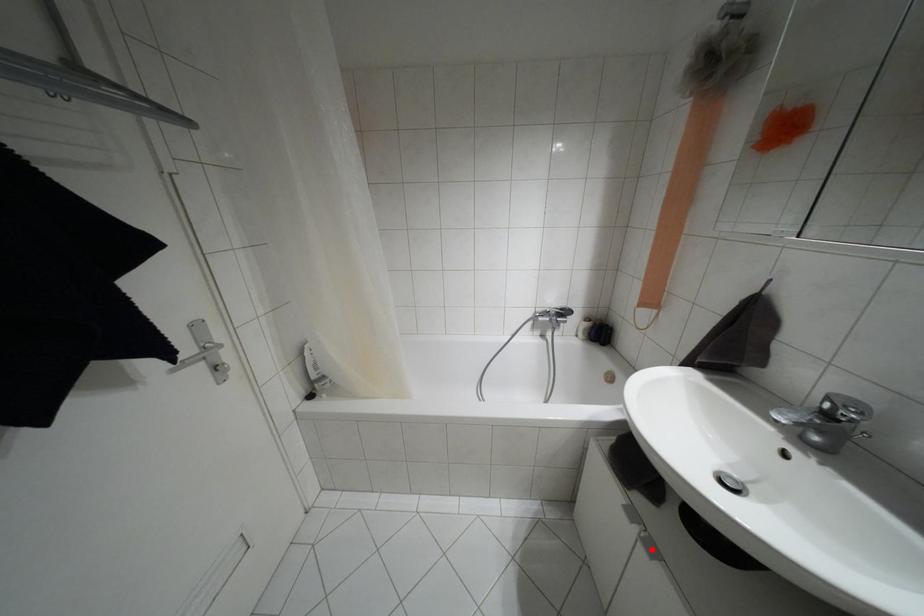
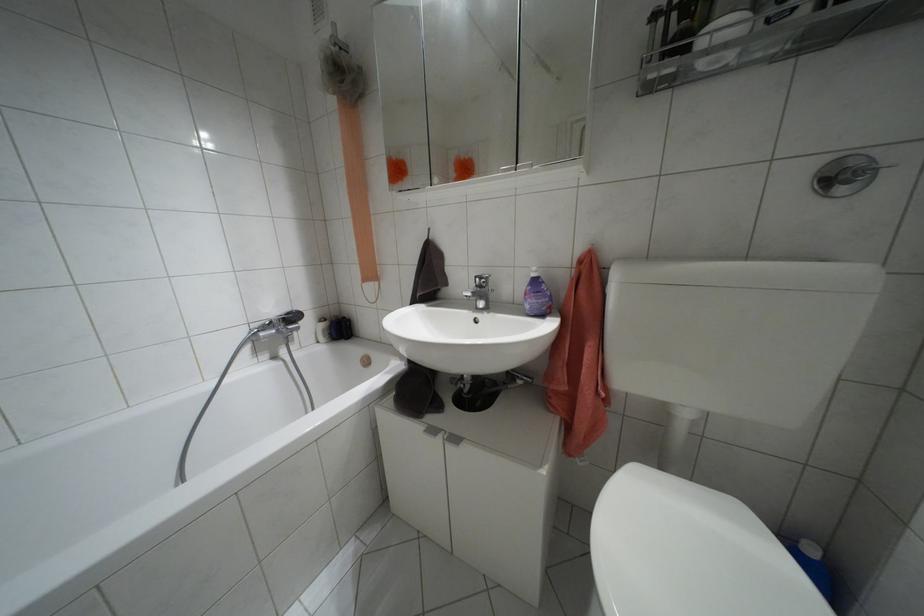
Find the pixel in the second image that matches the highlighted location in the first image.

(455, 439)